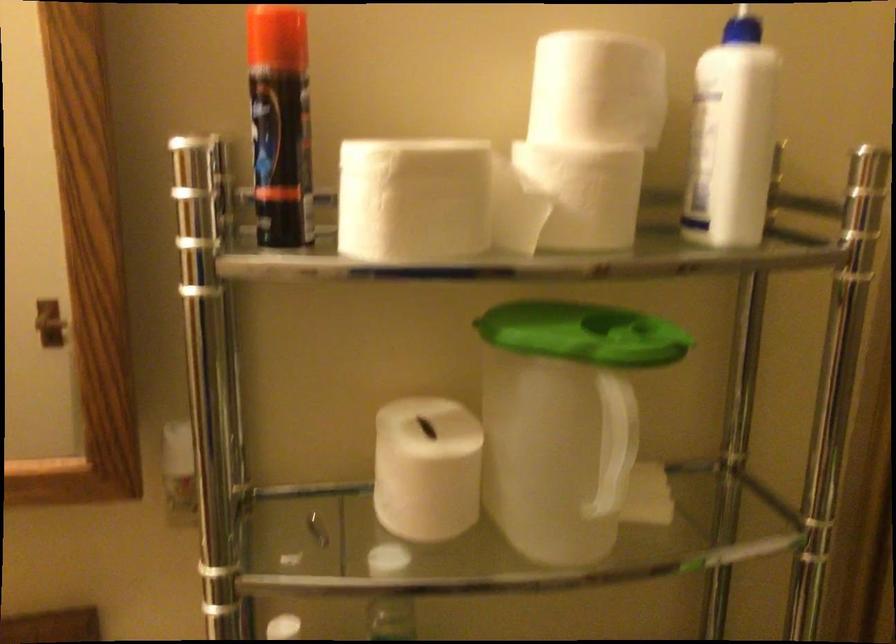
Where is `pitcher handle`? pitcher handle is located at coordinates (615, 442).